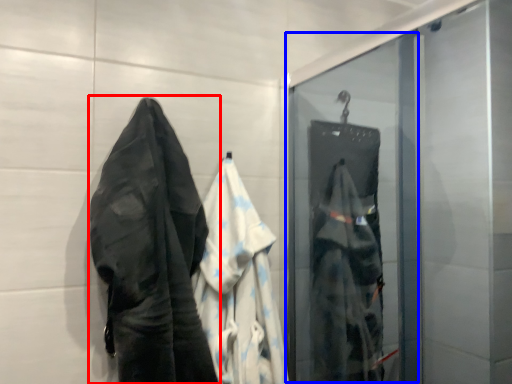
Question: Which object appears closest to the camera in this image, towel (highlighted by a red box) or screen door (highlighted by a blue box)?

Choices:
 (A) towel
 (B) screen door

Answer: (A)